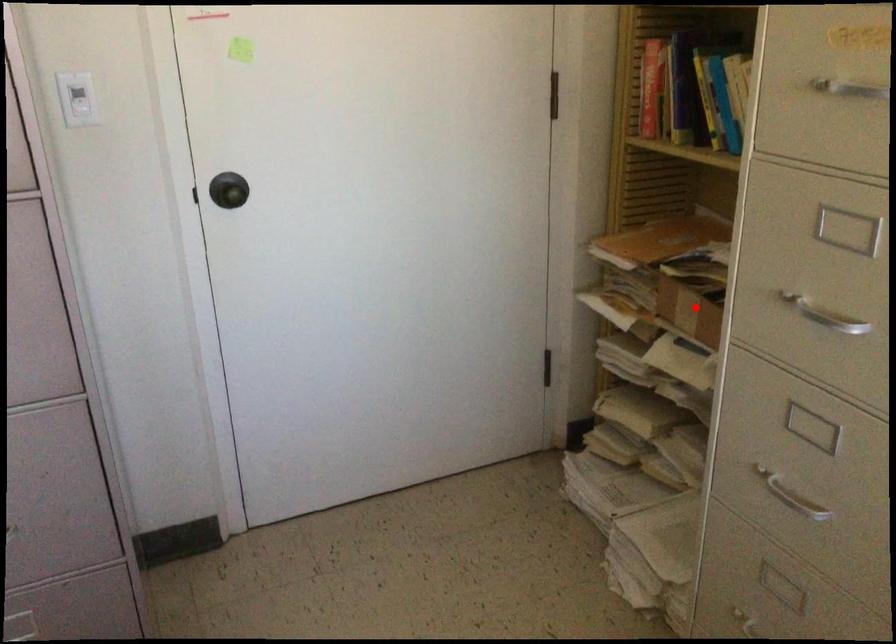
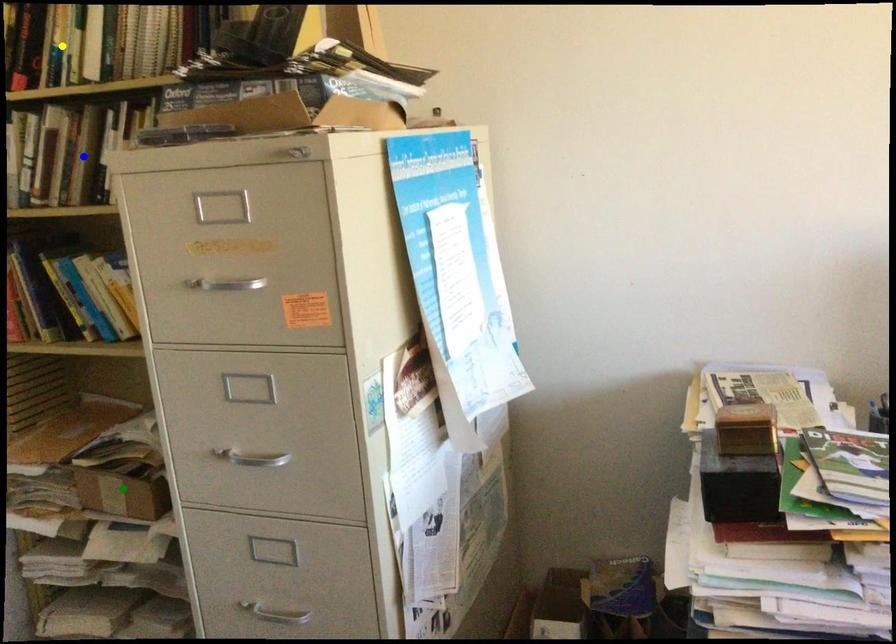
Question: I am providing you with two images of the same scene from different viewpoints. A red point is marked on the first image. You are given multiple points on the second image. Which mark in image 2 goes with the point in image 1?

Choices:
 (A) yellow point
 (B) green point
 (C) blue point

Answer: (B)